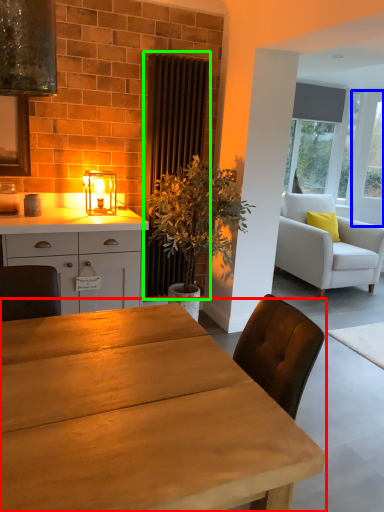
Question: Which object is the farthest from table (highlighted by a red box)? Choose among these: glass door (highlighted by a blue box) or curtain (highlighted by a green box).

Choices:
 (A) glass door
 (B) curtain

Answer: (A)